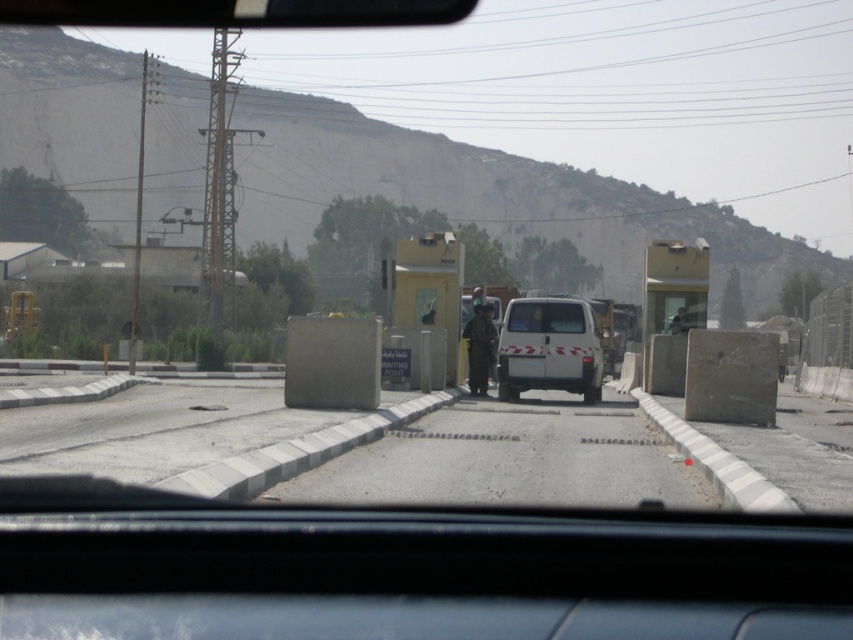
You are a passenger in the vehicle and notice the clear glass windshield at center and the camouflage uniform at center. Which object takes up more space in your view?

The clear glass windshield at center takes up more space in your view because it is larger in size than the camouflage uniform at center.

You are driving a car and need to pass through the checkpoint shown in the image. There is a white matte van at center and a camouflage uniform at center. Which object is closer to your car?

The white matte van at center is closer to your car because it is in front of the camouflage uniform at center.